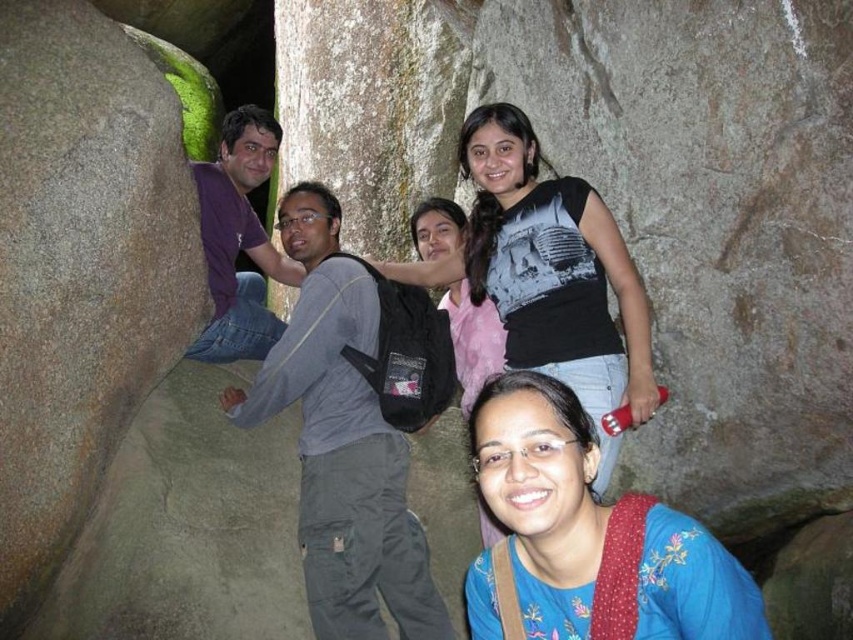
Which is more to the right, green mossy rock at left or blue embroidered blouse at center?

From the viewer's perspective, blue embroidered blouse at center appears more on the right side.

Can you confirm if green mossy rock at left is bigger than blue embroidered blouse at center?

Correct, green mossy rock at left is larger in size than blue embroidered blouse at center.

Between point (88, 321) and point (474, 436), which one is positioned in front?

Point (474, 436)

This screenshot has height=640, width=853. What are the coordinates of `green mossy rock at left` in the screenshot? It's located at (80, 269).

Which is above, green mossy rock at center or blue embroidered blouse at center?

green mossy rock at center is higher up.

Which of these two, green mossy rock at center or blue embroidered blouse at center, stands taller?

With more height is green mossy rock at center.

Find the location of `green mossy rock at center`. green mossy rock at center is located at coordinates (634, 196).

The image size is (853, 640). What are the coordinates of `green mossy rock at center` in the screenshot? It's located at (634, 196).

From the picture: Is green mossy rock at center positioned behind green mossy rock at left?

Yes, it is.

Which is above, green mossy rock at center or green mossy rock at left?

green mossy rock at center is above.

Is point (517, 100) farther from viewer compared to point (28, 212)?

Yes, it is behind point (28, 212).

At what (x,y) coordinates should I click in order to perform the action: click on green mossy rock at center. Please return your answer as a coordinate pair (x, y). This screenshot has height=640, width=853. Looking at the image, I should click on (634, 196).